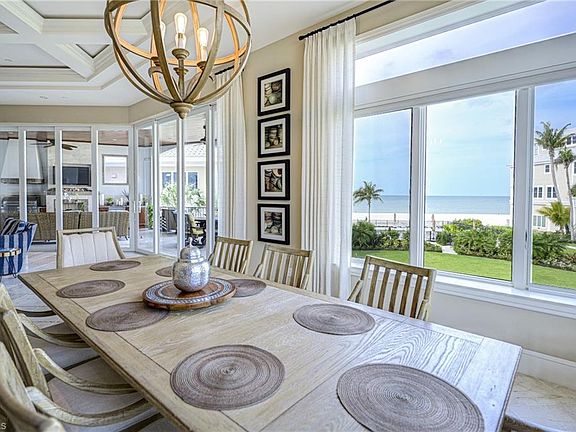
The image size is (576, 432). Find the location of `tea pot`. tea pot is located at coordinates click(178, 301).